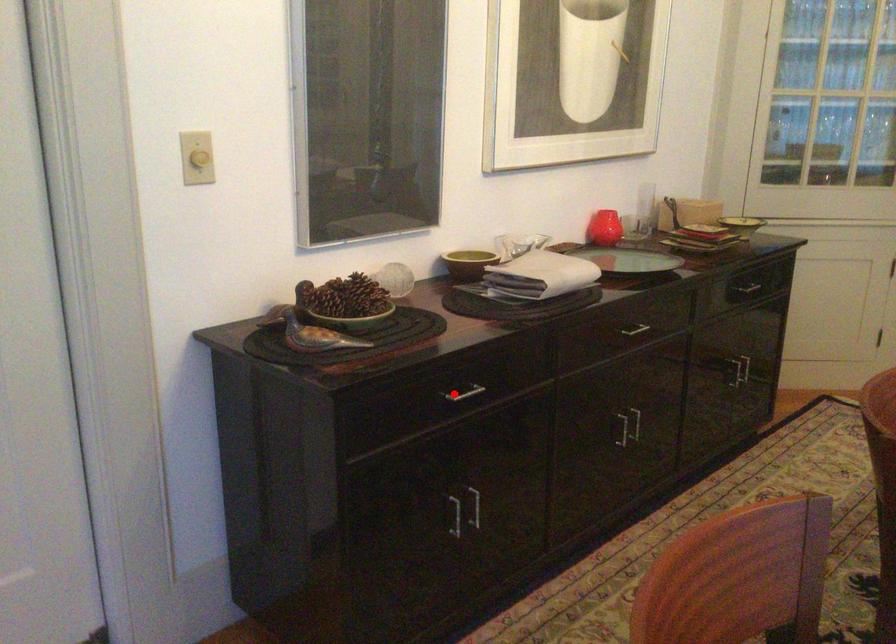
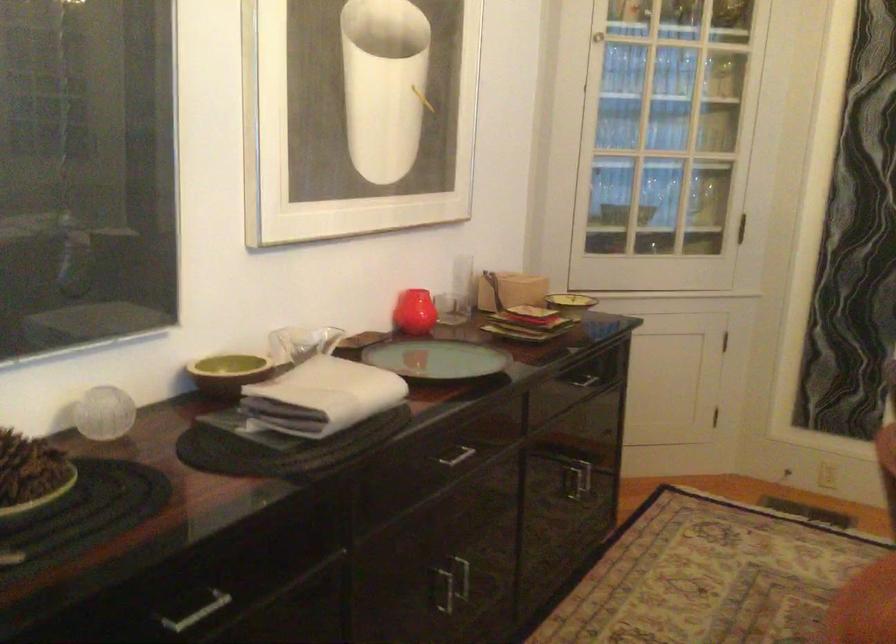
Question: I am providing you with two images of the same scene from different viewpoints. Image1 has a red point marked. In image2, the corresponding 3D location appears at what relative position? Reply with the corresponding letter.

Choices:
 (A) Closer
 (B) Farther

Answer: (A)